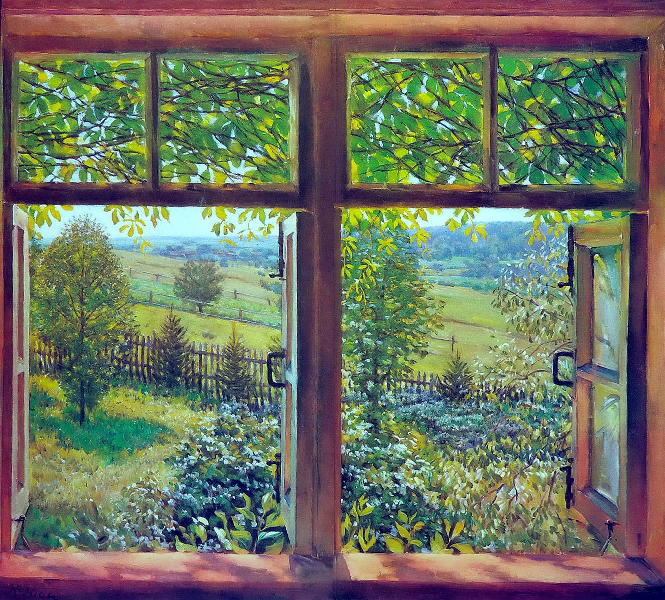
Locate an element on the screen. handle is located at coordinates (557, 369), (267, 370).